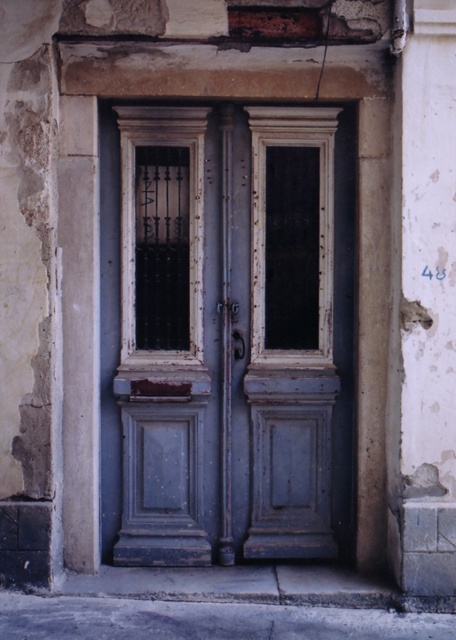
You are standing in front of the double doors. There is a point marked at coordinates (228, 333). What does this point indicate?

The point at coordinates (228, 333) marks the rusty wood door at center.

You are standing in front of a building with a rusty wood door at center. If you want to enter through the door, which direction should you walk relative to your current position?

The rusty wood door at center is located at point coordinates, so you should walk directly towards the center of the image to reach it.